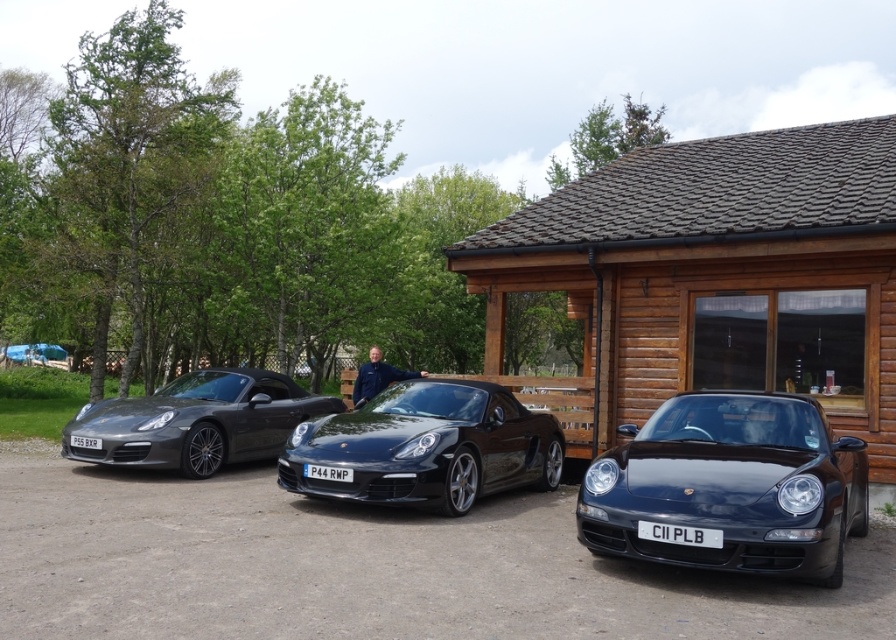
Question: Is wooden cabin at center positioned in front of white metallic license plate at center?

Choices:
 (A) no
 (B) yes

Answer: (A)

Question: Is wooden cabin at center positioned behind glossy black car at center?

Choices:
 (A) no
 (B) yes

Answer: (B)

Question: Which object is positioned farthest from the white plastic license plate at center?

Choices:
 (A) gray metallic license plate at left
 (B) glossy black porsche at center

Answer: (A)

Question: Among these objects, which one is farthest from the camera?

Choices:
 (A) gray metallic license plate at left
 (B) blue fabric jacket at center

Answer: (B)

Question: Which point is farther to the camera?

Choices:
 (A) blue fabric jacket at center
 (B) wooden cabin at center

Answer: (A)

Question: Considering the relative positions of glossy black car at center and white plastic license plate at center in the image provided, where is glossy black car at center located with respect to white plastic license plate at center?

Choices:
 (A) left
 (B) right

Answer: (B)